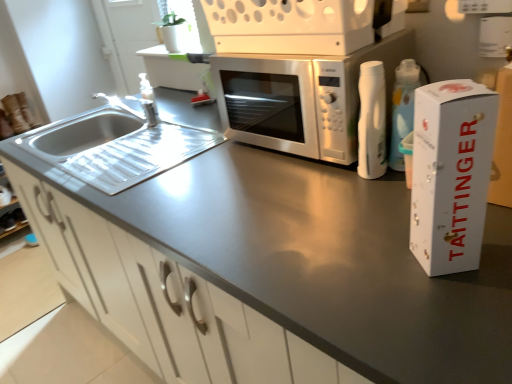
Find the location of a particular element. Image resolution: width=512 pixels, height=384 pixels. free space in front of white cardboard box at right is located at coordinates (458, 312).